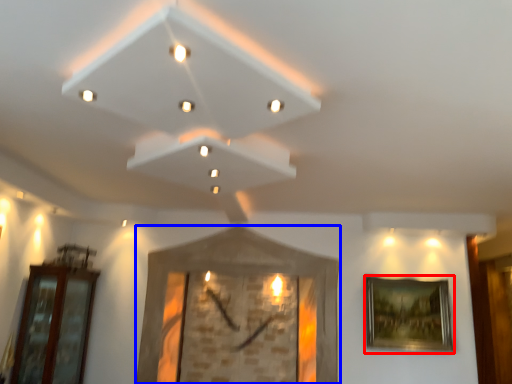
Question: Among these objects, which one is nearest to the camera, picture frame (highlighted by a red box) or picture frame (highlighted by a blue box)?

Choices:
 (A) picture frame
 (B) picture frame

Answer: (B)